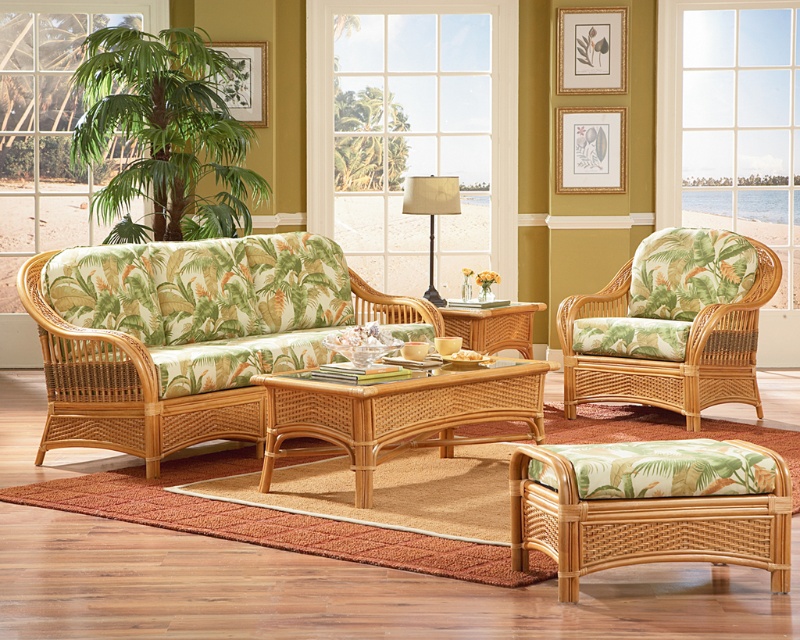
Question: Which object is closer to the camera taking this photo?

Choices:
 (A) matte gold picture frame at upper center
 (B) transparent glass window at upper left
 (C) gold-framed picture at upper center

Answer: (C)

Question: Which of the following is the farthest from the observer?

Choices:
 (A) woven rattan stool at lower right
 (B) woven rattan table at center

Answer: (B)

Question: Can you confirm if gold textured picture frame at upper center is positioned above woven wood coffee table at center?

Choices:
 (A) no
 (B) yes

Answer: (B)

Question: Can you confirm if green leafy plant at upper left is positioned below metallic gold lampshade at center?

Choices:
 (A) no
 (B) yes

Answer: (A)

Question: Can you confirm if clear glass window at upper right is positioned to the right of woven rattan couch at center?

Choices:
 (A) yes
 (B) no

Answer: (A)

Question: Among these points, which one is nearest to the camera?

Choices:
 (A) (522, 369)
 (B) (774, 33)
 (C) (40, 262)

Answer: (A)